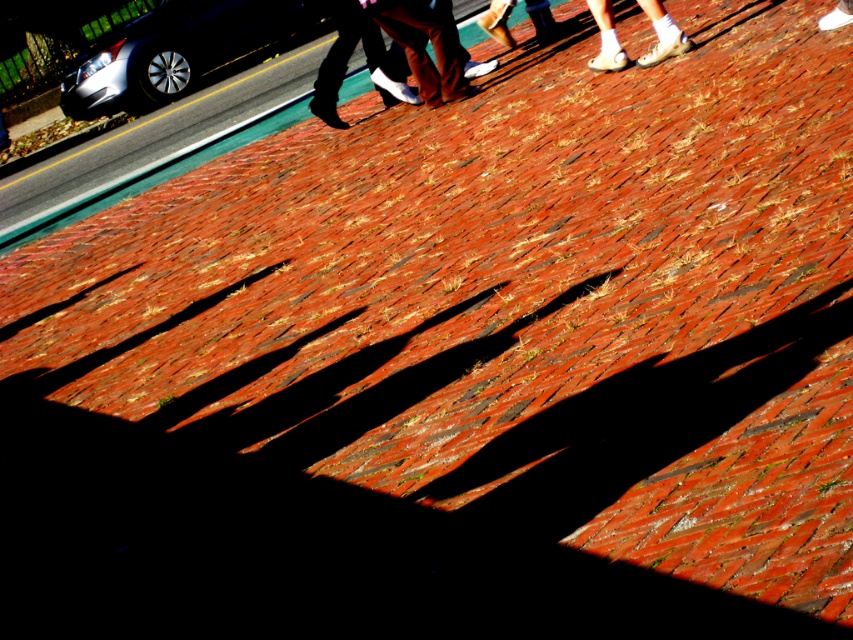
You are standing on the sidewalk looking at the brick surface. There are two points marked on the image, point 1 at coordinates point (122, 77) and point 2 at coordinates point (660, 22). Which point is closer to you?

Point (122, 77) is closer to you than point (660, 22) because it is further to the viewer than the other point.

You are a photographer standing at the sidewalk. You want to capture both the satin silver car at upper left and the brown leather shoes at upper center in a single frame. Which object should you zoom out more to include both?

You should zoom out more to include both the satin silver car at upper left and the brown leather shoes at upper center because the satin silver car at upper left is bigger than the brown leather shoes at upper center, requiring a wider angle to fit both in the frame.

You are a photographer standing on the sidewalk. You see the satin silver car at upper left and the white socks at upper center. Which object is closer to the camera based on their sizes?

The satin silver car at upper left is taller than the white socks at upper center, so it is closer to the camera.